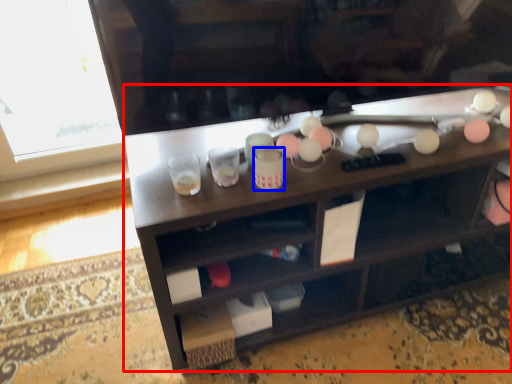
Question: Which point is further to the camera, desk (highlighted by a red box) or beverage (highlighted by a blue box)?

Choices:
 (A) desk
 (B) beverage

Answer: (B)